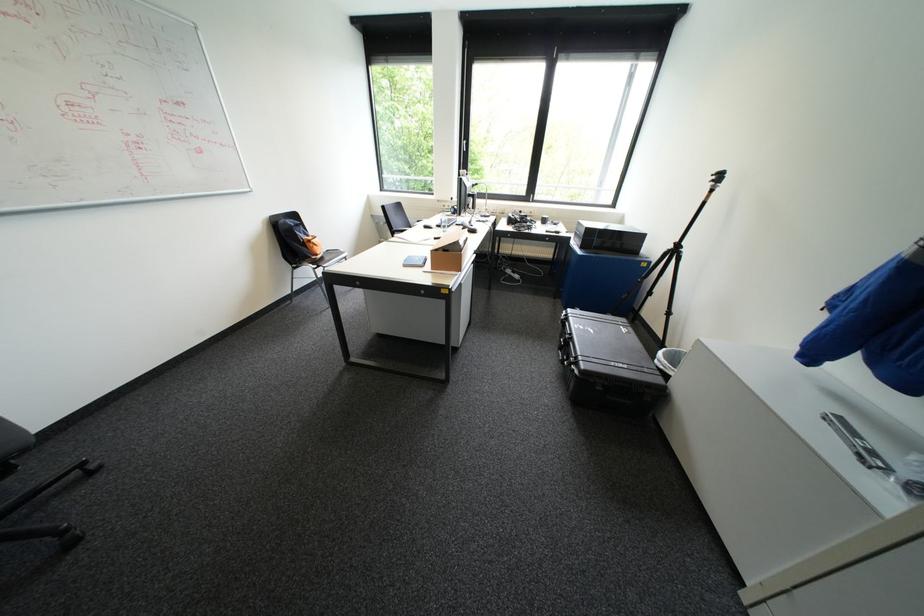
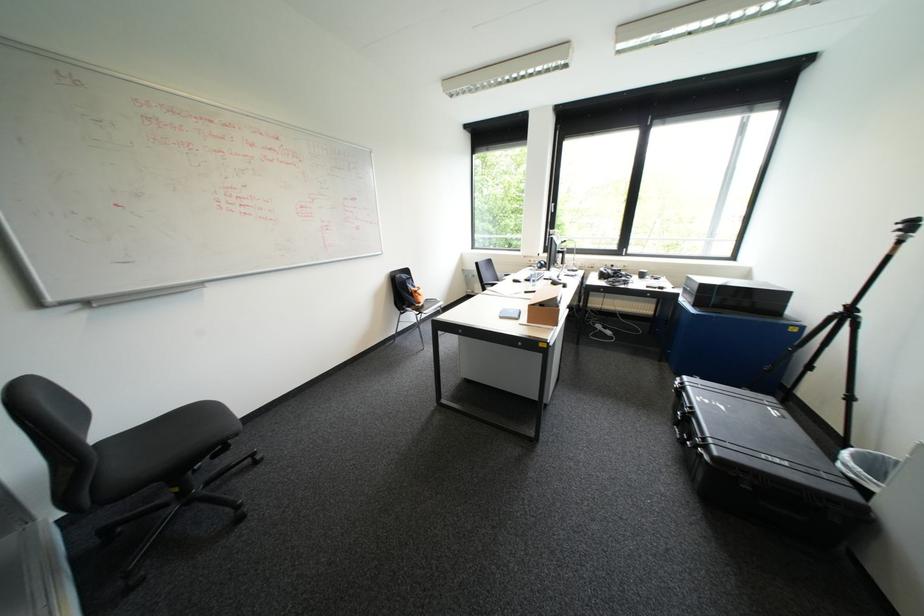
The point at (574, 361) is marked in the first image. Where is the corresponding point in the second image?

(697, 440)